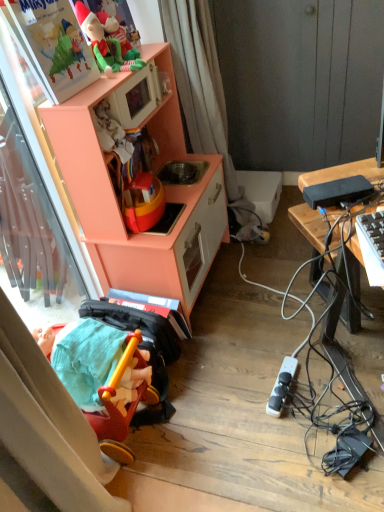
Identify the location of vacant area that lies in front of black plastic power strip at lower right, acting as the 1th appliance starting from the back. (291, 429).